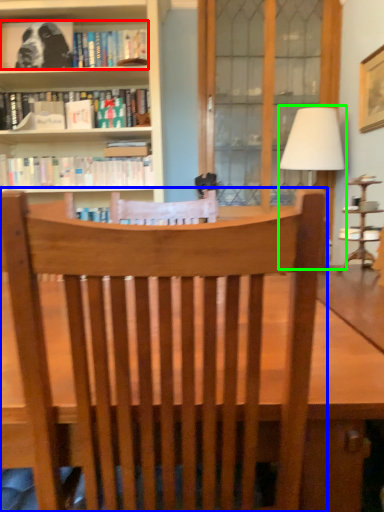
Question: Estimate the real-world distances between objects in this image. Which object is farther from book (highlighted by a red box), chair (highlighted by a blue box) or table lamp (highlighted by a green box)?

Choices:
 (A) chair
 (B) table lamp

Answer: (A)